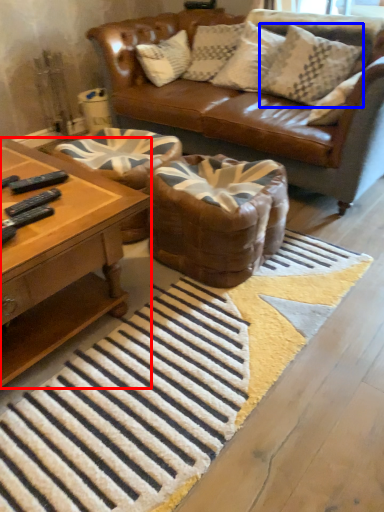
Question: Which object is closer to the camera taking this photo, coffee table (highlighted by a red box) or pillow (highlighted by a blue box)?

Choices:
 (A) coffee table
 (B) pillow

Answer: (A)